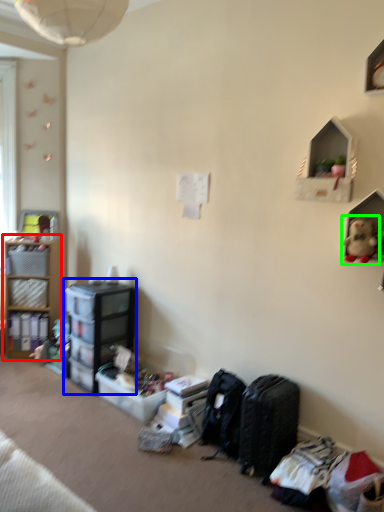
Question: Which is nearer to the shelf (highlighted by a red box)? shelf (highlighted by a blue box) or toy (highlighted by a green box).

Choices:
 (A) shelf
 (B) toy

Answer: (A)